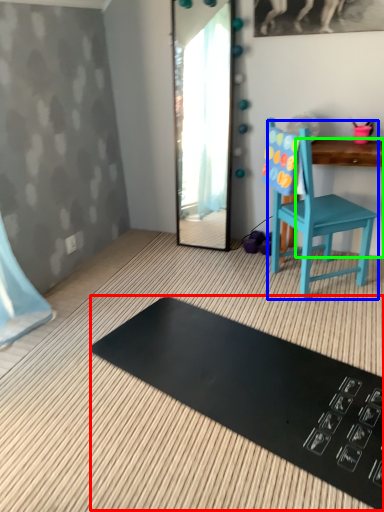
Question: Considering the real-world distances, which object is farthest from mat (highlighted by a red box)? chair (highlighted by a blue box) or changing table (highlighted by a green box)?

Choices:
 (A) chair
 (B) changing table

Answer: (B)